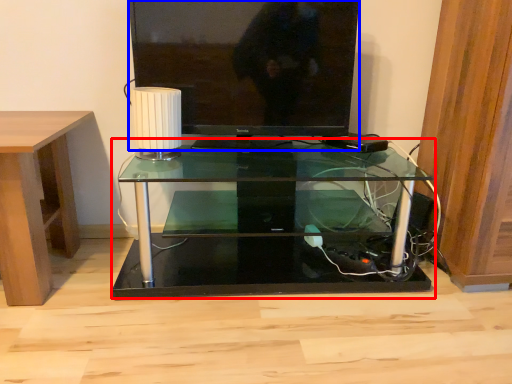
Question: Which object is closer to the camera taking this photo, table (highlighted by a red box) or television (highlighted by a blue box)?

Choices:
 (A) table
 (B) television

Answer: (A)